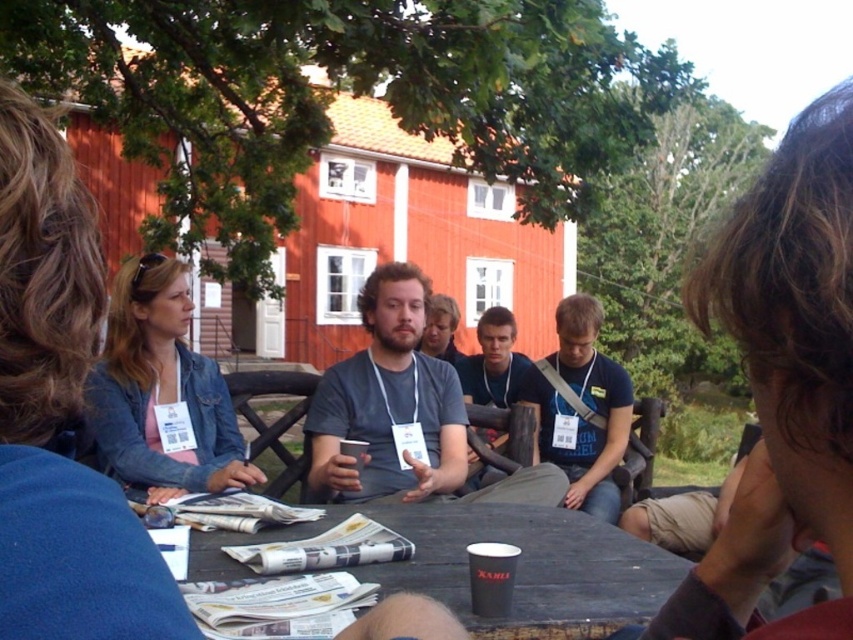
You are standing at the wooden table where the group is gathered. You want to reach the point marked at coordinates point (581, 593) without moving your feet. Can you stretch your arm to touch it?

The point (581, 593) is 4.55 feet from viewer, so yes, you can stretch your arm to touch it since the distance is within arm reach.

You are standing in front of the red wooden building and want to walk towards the two points marked in the image. Which point, point [550,609] or point [567,496], will you reach first?

Point [550,609] is closer to the viewer than point [567,496], so you will reach point [550,609] first.

You are organizing a photo shoot and need to arrange two shirts, the blue fabric shirt at center and the matte gray shirt at center, on a mannequin. Based on their sizes, which shirt should be placed on top to ensure visibility?

The blue fabric shirt at center should be placed on top because it has a larger size compared to the matte gray shirt at center, ensuring better visibility.